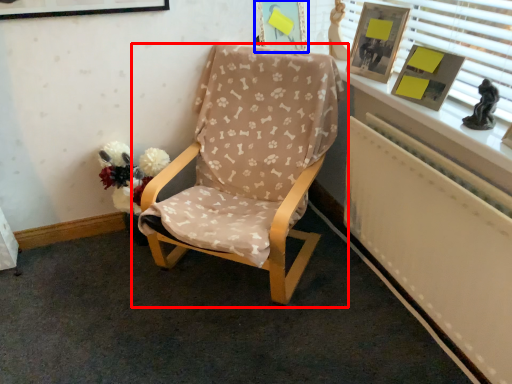
Question: Which object appears farthest to the camera in this image, chair (highlighted by a red box) or picture frame (highlighted by a blue box)?

Choices:
 (A) chair
 (B) picture frame

Answer: (B)